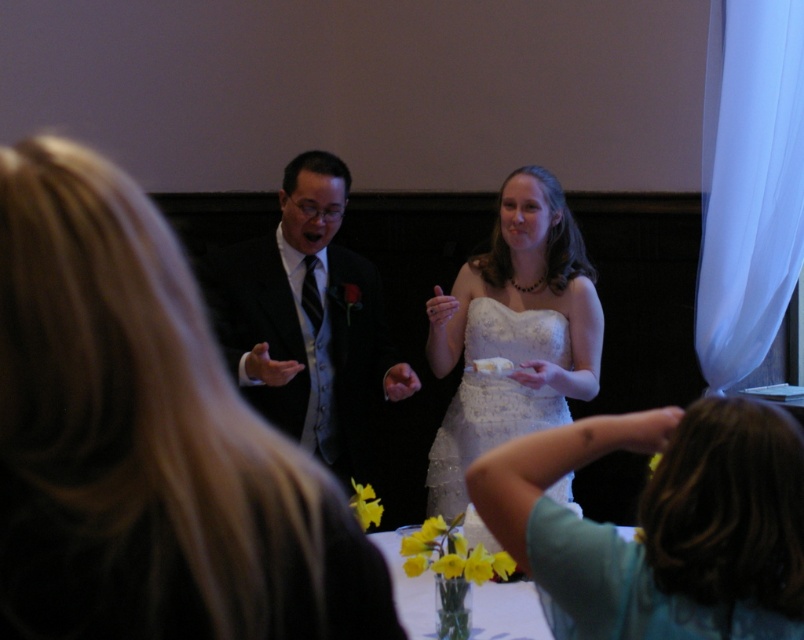
From the picture: Can you confirm if matte white dress at center is thinner than light brown hair at lower right?

Yes, matte white dress at center is thinner than light brown hair at lower right.

At what (x,y) coordinates should I click in order to perform the action: click on matte white dress at center. Please return your answer as a coordinate pair (x, y). The height and width of the screenshot is (640, 804). Looking at the image, I should click on (146, 440).

Is black satin suit at center to the left of white lace dress at center from the viewer's perspective?

Correct, you'll find black satin suit at center to the left of white lace dress at center.

Is black satin suit at center bigger than white lace dress at center?

Yes, black satin suit at center is bigger than white lace dress at center.

Find the location of a particular element. This screenshot has height=640, width=804. black satin suit at center is located at coordinates (306, 321).

The width and height of the screenshot is (804, 640). In order to click on black satin suit at center in this screenshot , I will do `click(306, 321)`.

Between light brown hair at lower right and white lace dress at center, which one appears on the right side from the viewer's perspective?

From the viewer's perspective, light brown hair at lower right appears more on the right side.

Is light brown hair at lower right in front of white lace dress at center?

That is True.

Between point (720, 512) and point (482, 449), which one is positioned behind?

Positioned behind is point (482, 449).

The width and height of the screenshot is (804, 640). In order to click on light brown hair at lower right in this screenshot , I will do `click(662, 524)`.